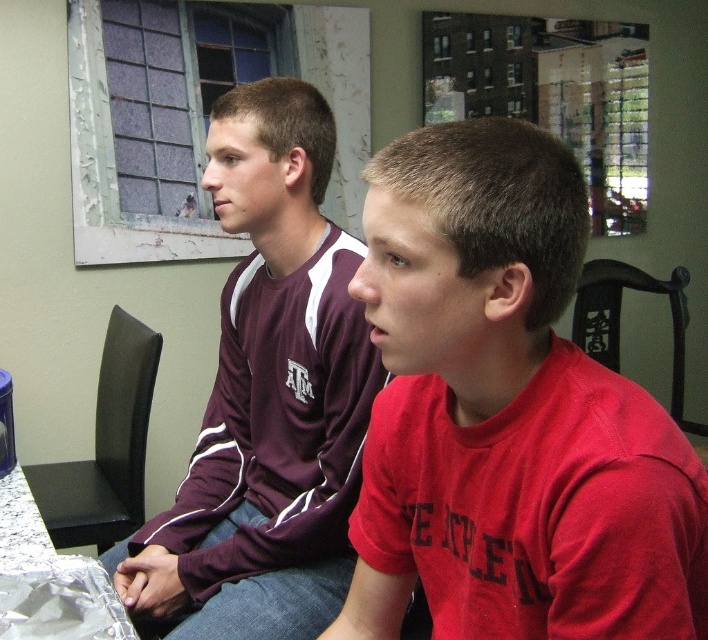
Question: Does red matte shirt at center have a greater width compared to maroon jersey at center?

Choices:
 (A) yes
 (B) no

Answer: (B)

Question: Does red matte shirt at center appear on the left side of maroon jersey at center?

Choices:
 (A) yes
 (B) no

Answer: (B)

Question: Which of the following is the closest to the observer?

Choices:
 (A) red matte shirt at center
 (B) maroon jersey at center

Answer: (A)

Question: Is red matte shirt at center positioned at the back of maroon jersey at center?

Choices:
 (A) yes
 (B) no

Answer: (B)